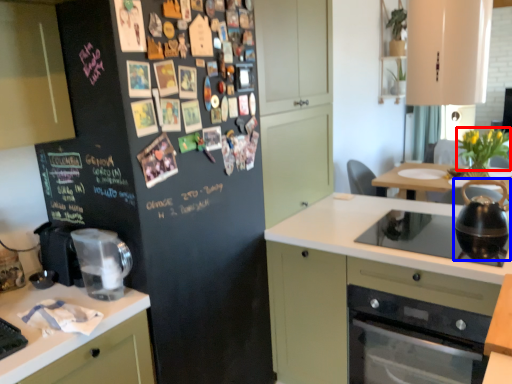
Question: Which point is closer to the camera, flower (highlighted by a red box) or kitchen appliance (highlighted by a blue box)?

Choices:
 (A) flower
 (B) kitchen appliance

Answer: (B)